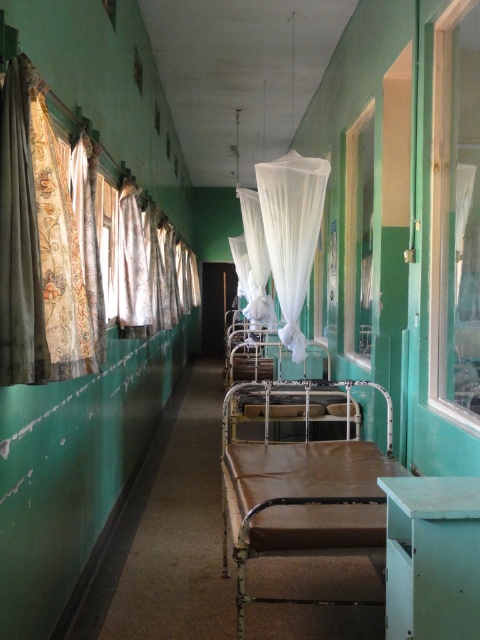
Does textured beige curtain at left have a lesser width compared to white sheer curtain at center?

Yes, textured beige curtain at left is thinner than white sheer curtain at center.

Is textured beige curtain at left bigger than white sheer curtain at center?

No, textured beige curtain at left is not bigger than white sheer curtain at center.

Where is `textured beige curtain at left`? The width and height of the screenshot is (480, 640). textured beige curtain at left is located at coordinates (19, 237).

Is the position of brown leather bed at center more distant than that of white sheer curtain at center?

No, it is in front of white sheer curtain at center.

Looking at this image, can you confirm if brown leather bed at center is thinner than white sheer curtain at center?

Incorrect, brown leather bed at center's width is not less than white sheer curtain at center's.

The width and height of the screenshot is (480, 640). What are the coordinates of `brown leather bed at center` in the screenshot? It's located at pos(301,492).

Is patterned fabric curtain at left below clear glass window at center?

Yes.

Locate an element on the screen. patterned fabric curtain at left is located at coordinates (45, 246).